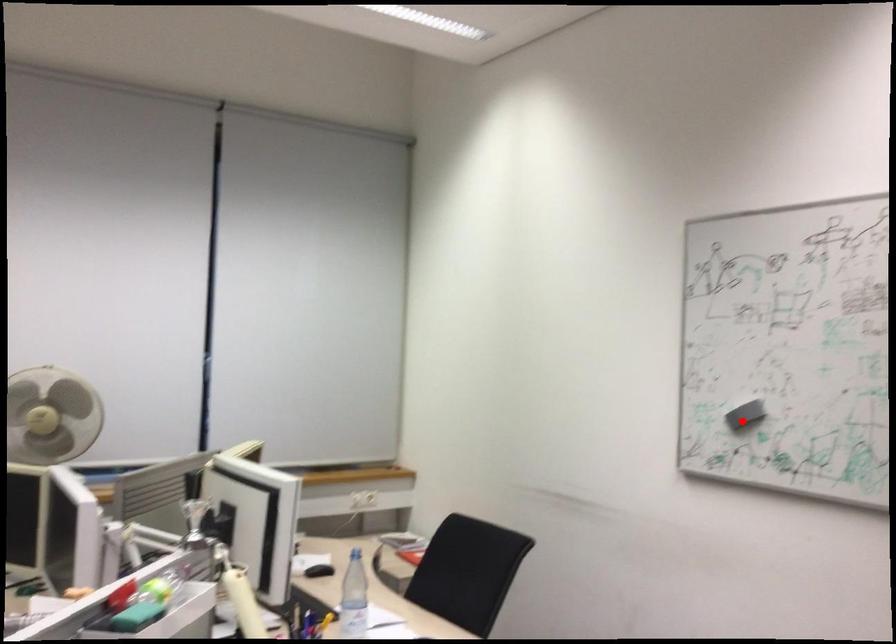
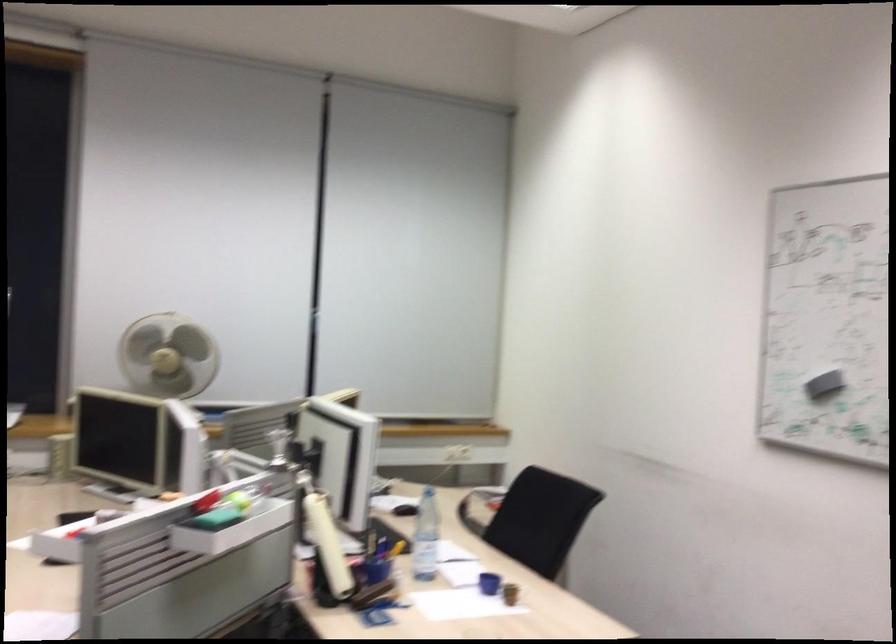
Where in the second image is the point corresponding to the highlighted location from the first image?

(823, 384)